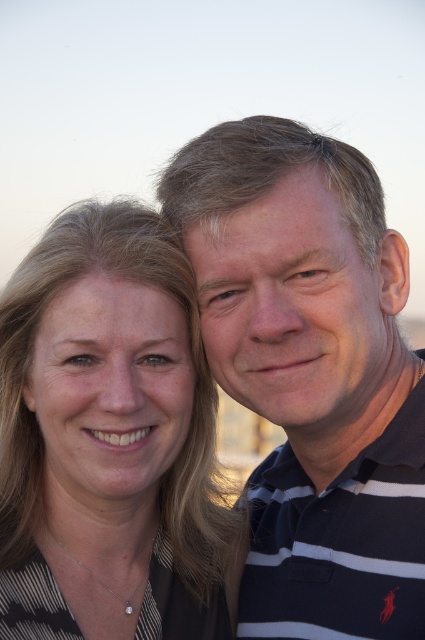
Question: Can you confirm if matte black shirt at left is smaller than dark blue striped polo shirt at right?

Choices:
 (A) no
 (B) yes

Answer: (B)

Question: Can you confirm if matte black shirt at left is positioned to the right of dark blue striped polo shirt at right?

Choices:
 (A) no
 (B) yes

Answer: (A)

Question: Does matte black shirt at left appear over dark blue striped polo shirt at right?

Choices:
 (A) no
 (B) yes

Answer: (A)

Question: Which of the following is the closest to the observer?

Choices:
 (A) matte striped polo shirt at center
 (B) dark blue striped polo shirt at right

Answer: (B)

Question: Which point appears closest to the camera in this image?

Choices:
 (A) (197, 465)
 (B) (328, 198)

Answer: (B)

Question: Which point is farther to the camera?

Choices:
 (A) dark blue striped polo shirt at right
 (B) matte striped polo shirt at center

Answer: (B)